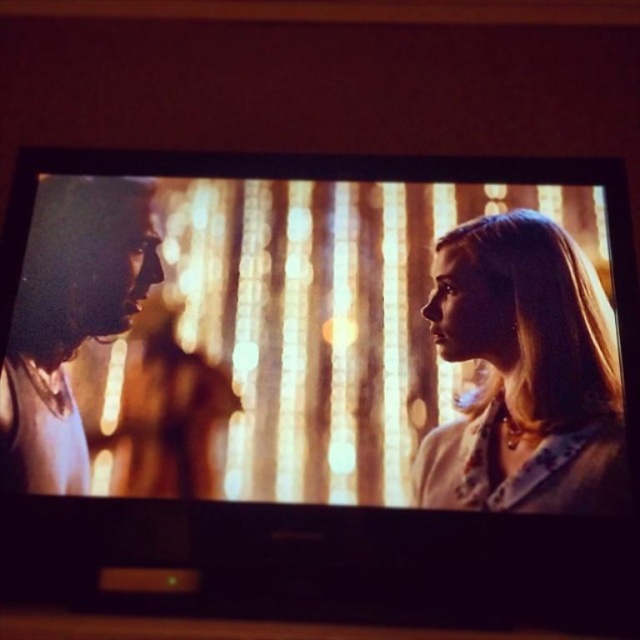
Question: Does blonde hair at right have a lesser width compared to smooth blonde hair at left?

Choices:
 (A) yes
 (B) no

Answer: (B)

Question: Can you confirm if blonde hair at right is positioned below smooth blonde hair at left?

Choices:
 (A) yes
 (B) no

Answer: (A)

Question: Is blonde hair at right to the left of smooth blonde hair at left from the viewer's perspective?

Choices:
 (A) yes
 (B) no

Answer: (B)

Question: Which point is closer to the camera?

Choices:
 (A) blonde hair at right
 (B) smooth blonde hair at left

Answer: (A)

Question: Among these objects, which one is nearest to the camera?

Choices:
 (A) blonde hair at right
 (B) smooth blonde hair at left

Answer: (A)

Question: Which object is farther from the camera taking this photo?

Choices:
 (A) smooth blonde hair at left
 (B) blonde hair at right

Answer: (A)